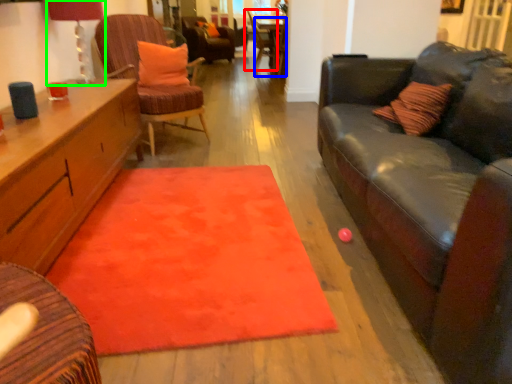
Question: Which object is positioned farthest from chair (highlighted by a red box)? Select from table (highlighted by a blue box) and lamp (highlighted by a green box).

Choices:
 (A) table
 (B) lamp

Answer: (B)